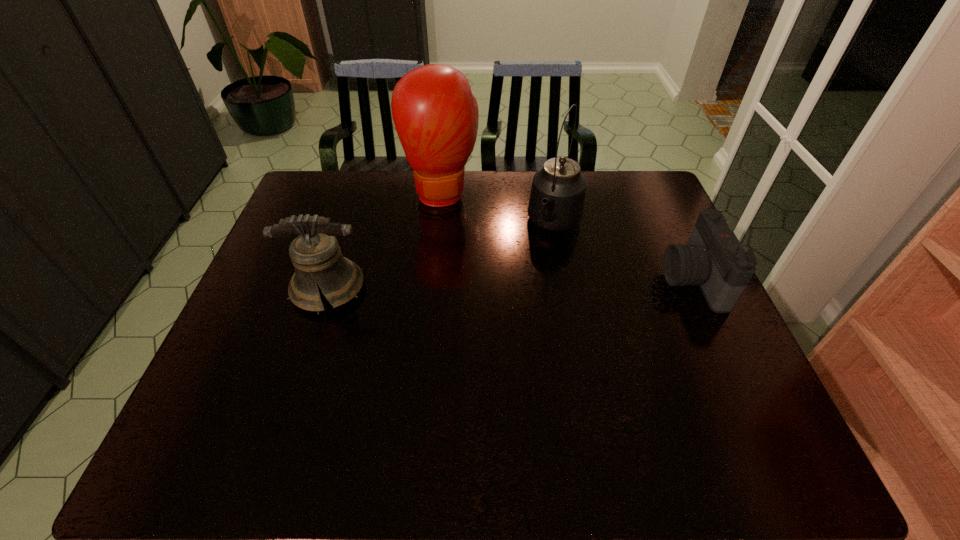
What are the coordinates of `vacant region located 0.060m spout on the kettle` in the screenshot? It's located at (540, 260).

This screenshot has width=960, height=540. I want to click on vacant space located 0.270m spout on the kettle, so click(x=514, y=312).

The height and width of the screenshot is (540, 960). What are the coordinates of `vacant space situated 0.220m spout on the kettle` in the screenshot? It's located at pyautogui.click(x=520, y=299).

Locate an element on the screen. free space located on the striking surface of the boxing glove is located at coordinates (458, 261).

Where is `free region located on the striking surface of the boxing glove`? Image resolution: width=960 pixels, height=540 pixels. free region located on the striking surface of the boxing glove is located at coordinates (469, 309).

You are a GUI agent. You are given a task and a screenshot of the screen. Output one action in this format:
    pyautogui.click(x=<x>, y=<y>)
    Task: Click on the free location located on the striking surface of the boxing glove
    The height and width of the screenshot is (540, 960).
    Given the screenshot: What is the action you would take?
    pyautogui.click(x=453, y=241)

In order to click on kettle situated at the far edge in this screenshot , I will do `click(557, 198)`.

Identify the location of boxing glove present at the far edge. (435, 114).

You are a GUI agent. You are given a task and a screenshot of the screen. Output one action in this format:
    pyautogui.click(x=<x>, y=<y>)
    Task: Click on the object that is at the left edge
    This screenshot has height=540, width=960.
    Given the screenshot: What is the action you would take?
    pyautogui.click(x=316, y=256)

Image resolution: width=960 pixels, height=540 pixels. I want to click on object at the right edge, so click(x=713, y=258).